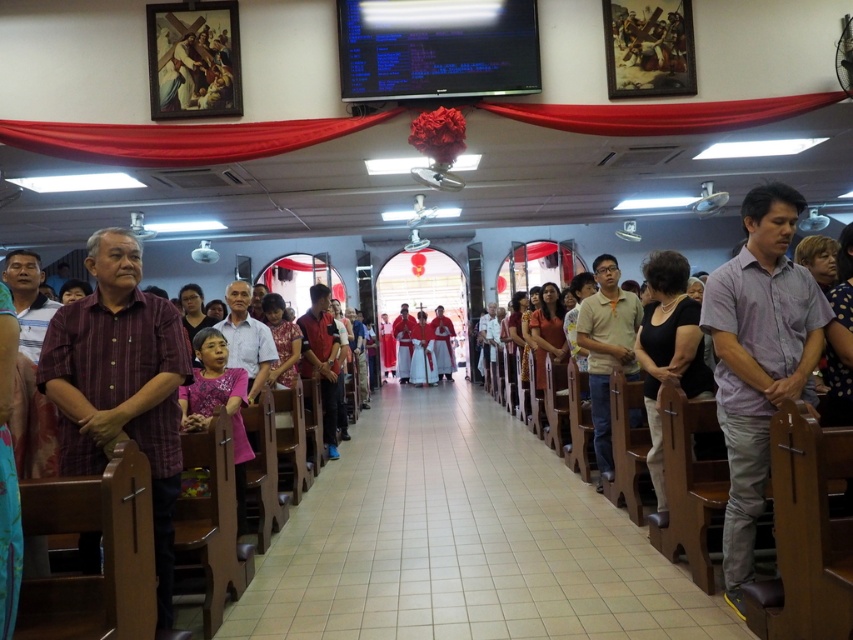
Question: Which point is farther to the camera?

Choices:
 (A) (302, 524)
 (B) (55, 390)
 (C) (595, 356)
 (D) (740, 525)

Answer: (C)

Question: Does purple striped shirt at left have a smaller size compared to orange cotton polo shirt at center?

Choices:
 (A) no
 (B) yes

Answer: (B)

Question: Which of the following is the closest to the observer?

Choices:
 (A) (445, 428)
 (B) (654, 374)

Answer: (B)

Question: Among these points, which one is nearest to the camera?

Choices:
 (A) (691, 385)
 (B) (457, 452)

Answer: (A)

Question: Can you confirm if purple cotton shirt at center is wider than orange cotton polo shirt at center?

Choices:
 (A) yes
 (B) no

Answer: (A)

Question: Is white tile aisle at center to the left of purple striped shirt at left from the viewer's perspective?

Choices:
 (A) no
 (B) yes

Answer: (A)